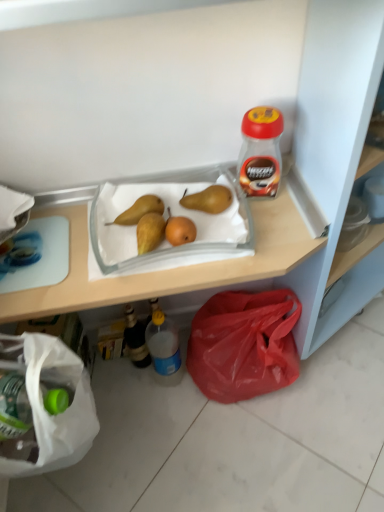
Identify the location of vacant area that is in front of translucent glass bottle at lower left, which is the 2th bottle in bottom-to-top order. The height and width of the screenshot is (512, 384). coord(145,407).